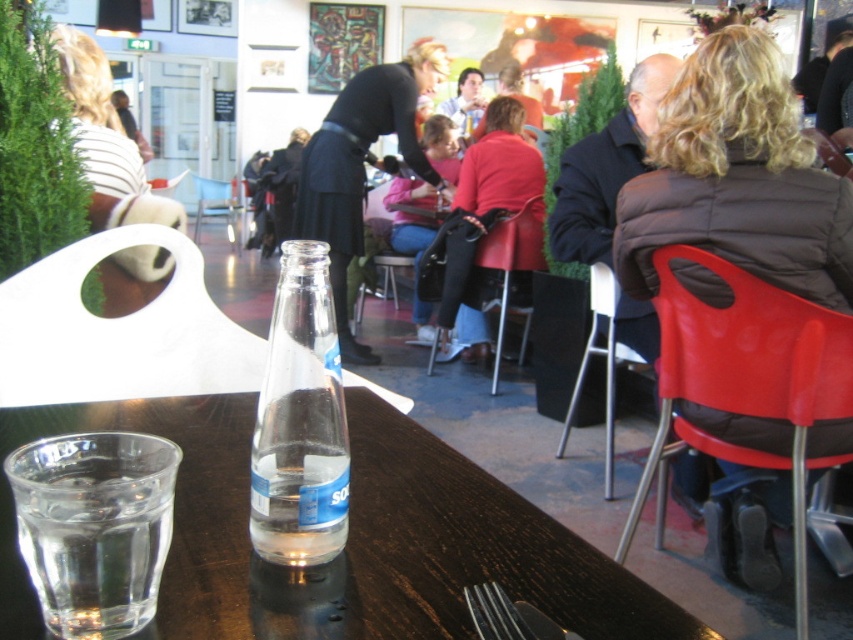
You are a customer at the cafe and want to place your phone on the clear glass water at lower left. However, you are worried it might not be stable. Can you place your phone there without it tipping over, considering the height difference between the clear glass water and the smooth plastic chair at right?

The clear glass water at lower left is not as tall as the smooth plastic chair at right, so the glass is shorter. Since the glass is shorter, placing your phone on it might be unstable because the glass is lower than the chair. However, the stability also depends on the surface area of the glass. If the glass has a wide base, it might still be stable. But based on the height difference alone, the glass is shorter than the chair, so it might not provide a stable surface.

You are a customer at the cafe and want to grab your matte black bag at center without moving your clear glass water at lower left. Can you reach it?

The clear glass water at lower left is located below the matte black bag at center, so you can reach the matte black bag at center without disturbing the clear glass water at lower left.

You are sitting at the dark wooden table in the foreground of the cafe. You want to reach for an item located at point (648, 483) and another item at point (74, 44). Which item will you need to reach for first if you want to grab the one closer to you?

The item at point (648, 483) is closer to you, so you should reach for it first.